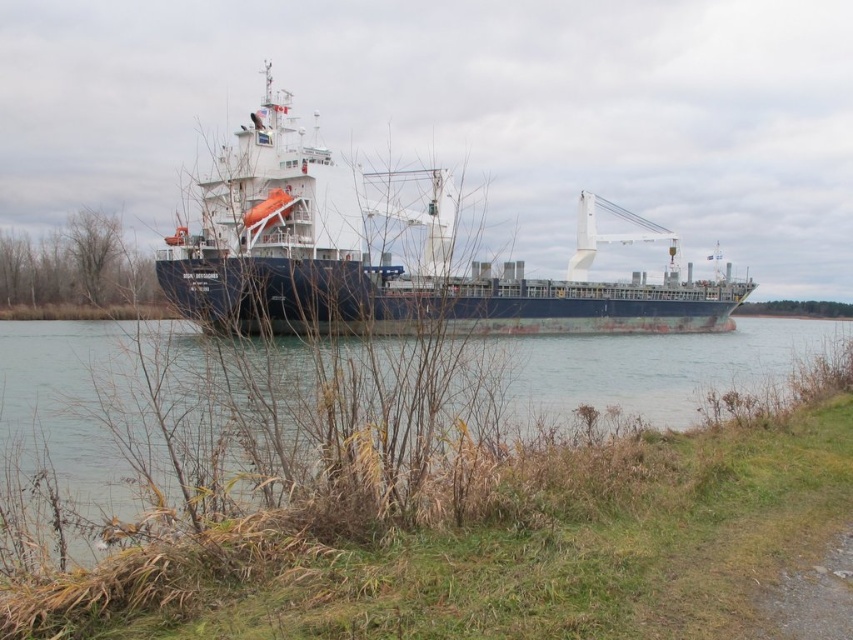
Question: Can you confirm if blue matte cargo ship at center is positioned to the left of dark blue water at center?

Choices:
 (A) no
 (B) yes

Answer: (A)

Question: Among these objects, which one is nearest to the camera?

Choices:
 (A) dark blue water at center
 (B) blue matte cargo ship at center

Answer: (B)

Question: Is blue matte cargo ship at center positioned at the back of dark blue water at center?

Choices:
 (A) no
 (B) yes

Answer: (A)

Question: Among these points, which one is nearest to the camera?

Choices:
 (A) (109, 324)
 (B) (282, 326)

Answer: (B)

Question: Is blue matte cargo ship at center to the left of dark blue water at center from the viewer's perspective?

Choices:
 (A) no
 (B) yes

Answer: (A)